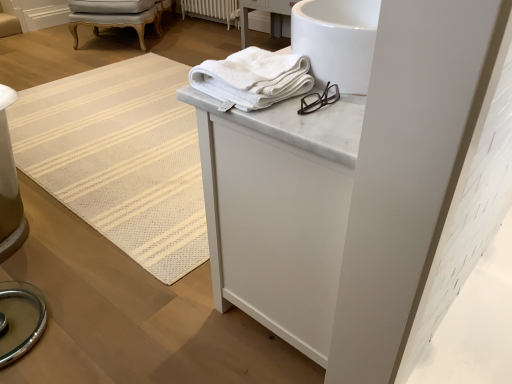
Find the location of a particular element. This screenshot has width=512, height=384. vacant space to the left of white marble cabinet at upper center is located at coordinates (143, 268).